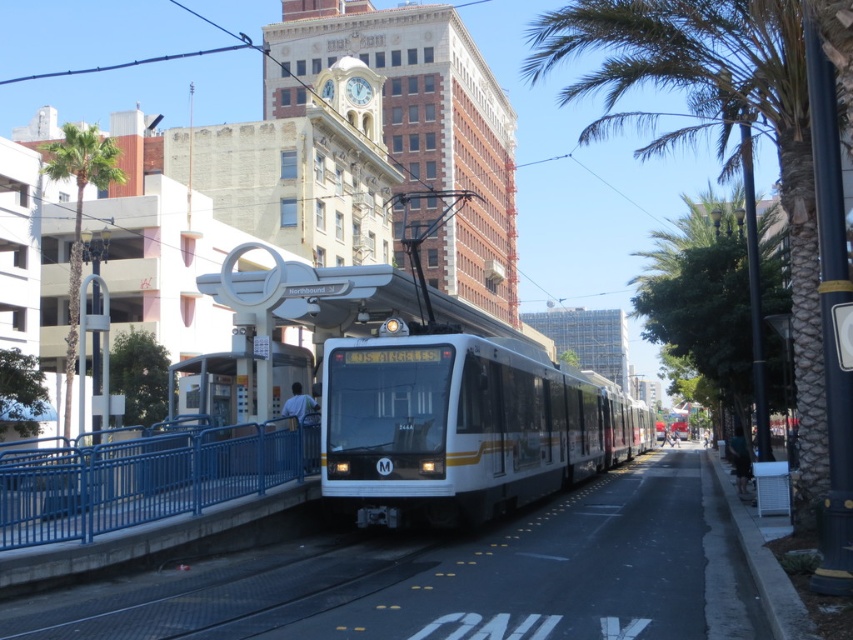
Question: Among these objects, which one is nearest to the camera?

Choices:
 (A) white glossy train at center
 (B) green leafy palm tree at left

Answer: (A)

Question: Considering the relative positions of blue metal railing at lower left and green leafy palm tree at left in the image provided, where is blue metal railing at lower left located with respect to green leafy palm tree at left?

Choices:
 (A) right
 (B) left

Answer: (A)

Question: Which object is farther from the camera taking this photo?

Choices:
 (A) green leafy palm tree at left
 (B) blue metal railing at lower left

Answer: (A)

Question: Is white glossy train at center further to camera compared to blue metal railing at lower left?

Choices:
 (A) no
 (B) yes

Answer: (B)

Question: Which point appears closest to the camera in this image?

Choices:
 (A) (71, 342)
 (B) (349, 348)

Answer: (B)

Question: In this image, where is white glossy train at center located relative to blue metal railing at lower left?

Choices:
 (A) below
 (B) above

Answer: (A)